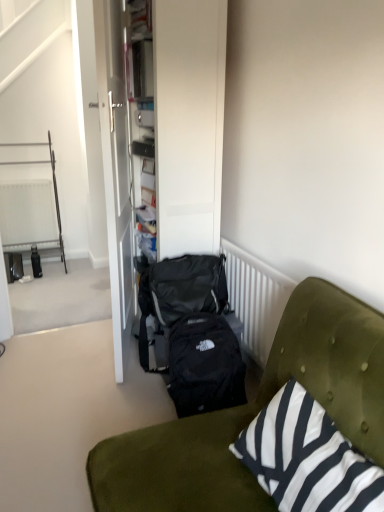
Locate an element on the screen. vacant region to the right of matte black bottle at left is located at coordinates (55, 278).